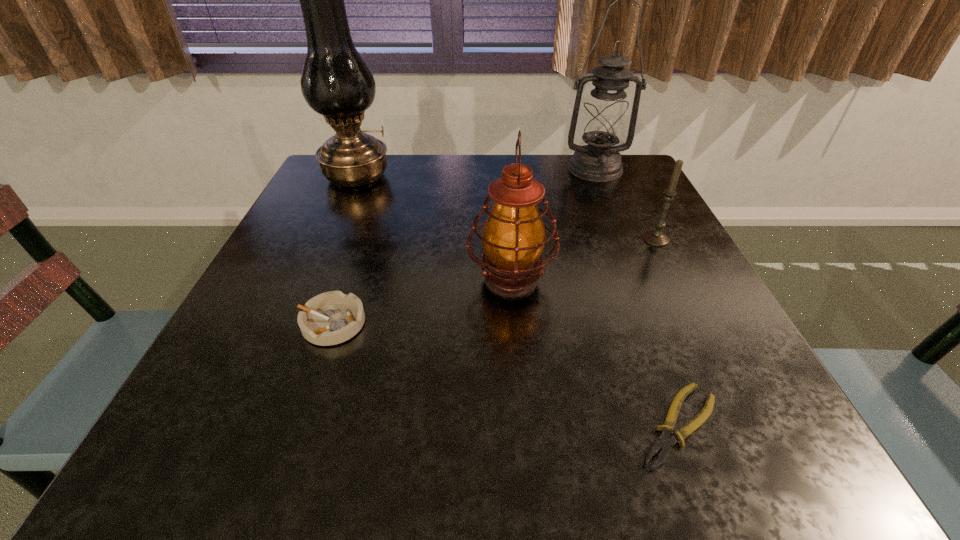
Where is `the leftmost oil lamp`? This screenshot has height=540, width=960. the leftmost oil lamp is located at coordinates (336, 82).

In order to click on the rightmost oil lamp in this screenshot , I will do `click(604, 118)`.

You are a GUI agent. You are given a task and a screenshot of the screen. Output one action in this format:
    pyautogui.click(x=<x>, y=<y>)
    Task: Click on the third tallest object
    The width and height of the screenshot is (960, 540).
    Given the screenshot: What is the action you would take?
    pyautogui.click(x=513, y=238)

Locate an element on the screen. Image resolution: width=960 pixels, height=540 pixels. the second oil lamp from left to right is located at coordinates (513, 238).

I want to click on the fourth tallest object, so click(x=656, y=237).

I want to click on candle, so click(x=656, y=237).

You are a GUI agent. You are given a task and a screenshot of the screen. Output one action in this format:
    pyautogui.click(x=<x>, y=<y>)
    Task: Click on the ashtray
    
    Given the screenshot: What is the action you would take?
    pyautogui.click(x=330, y=318)

Locate an element on the screen. the shortest object is located at coordinates (664, 443).

Find the location of a particular element. This screenshot has height=540, width=960. the nearest object is located at coordinates (664, 443).

Locate an element on the screen. This screenshot has width=960, height=540. free point located 0.160m on the right of the leftmost oil lamp is located at coordinates (453, 177).